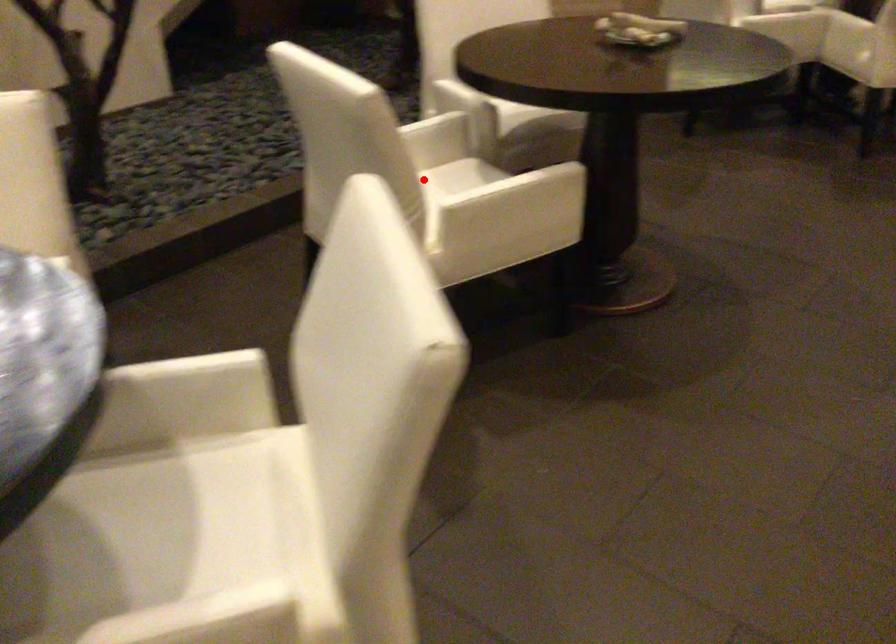
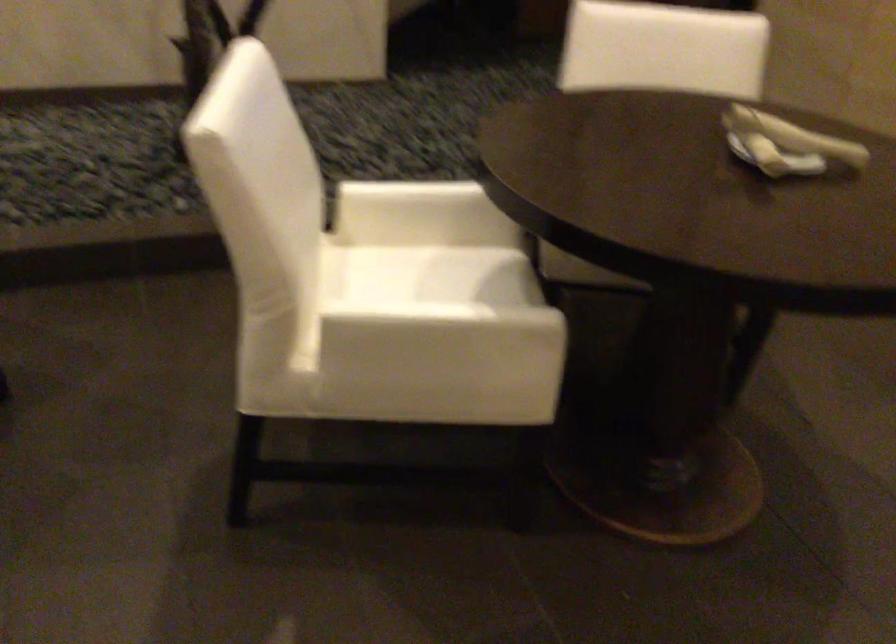
Question: A red point is marked in image1. In image2, is the corresponding 3D point closer to the camera or farther? Reply with the corresponding letter.

Choices:
 (A) The corresponding 3D point is closer.
 (B) The corresponding 3D point is farther.

Answer: (A)